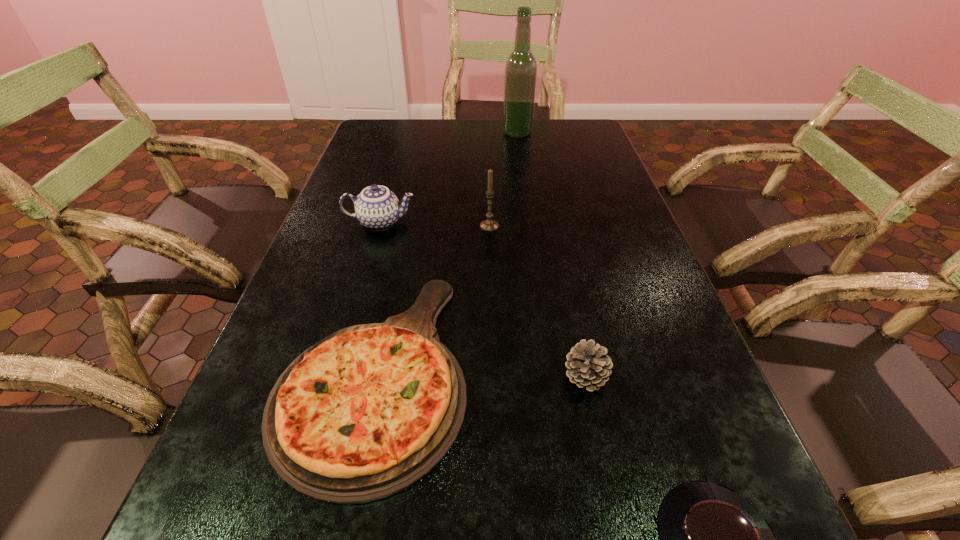
The height and width of the screenshot is (540, 960). Find the location of `the farthest object`. the farthest object is located at coordinates (520, 78).

Where is `liquor`? The width and height of the screenshot is (960, 540). liquor is located at coordinates (520, 78).

At what (x,y) coordinates should I click in order to perform the action: click on the fourth object from right to left. Please return your answer as a coordinate pair (x, y). The image size is (960, 540). Looking at the image, I should click on (487, 225).

Identify the location of candle. (x=487, y=225).

At what (x,y) coordinates should I click in order to perform the action: click on chinaware. Please return your answer as a coordinate pair (x, y). The image size is (960, 540). Looking at the image, I should click on pos(376,207).

Where is `pinecone`? The image size is (960, 540). pinecone is located at coordinates (588, 366).

The height and width of the screenshot is (540, 960). Find the location of `pizza`. pizza is located at coordinates (366, 412).

Locate an element on the screen. vacant area located on the right of the farthest object is located at coordinates point(596,133).

You are a GUI agent. You are given a task and a screenshot of the screen. Output one action in this format:
    pyautogui.click(x=<x>, y=<y>)
    Task: Click on the free space located on the back of the candle
    This screenshot has width=960, height=540.
    Given the screenshot: What is the action you would take?
    pyautogui.click(x=488, y=178)

Where is `vacant point located 0.160m from the spout of the fourth shortest object`? This screenshot has height=540, width=960. vacant point located 0.160m from the spout of the fourth shortest object is located at coordinates (479, 222).